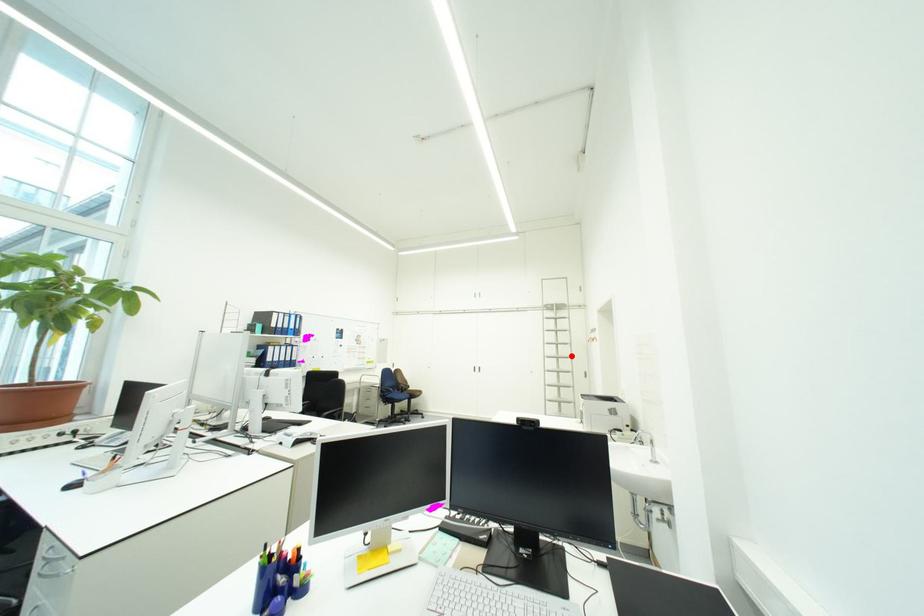
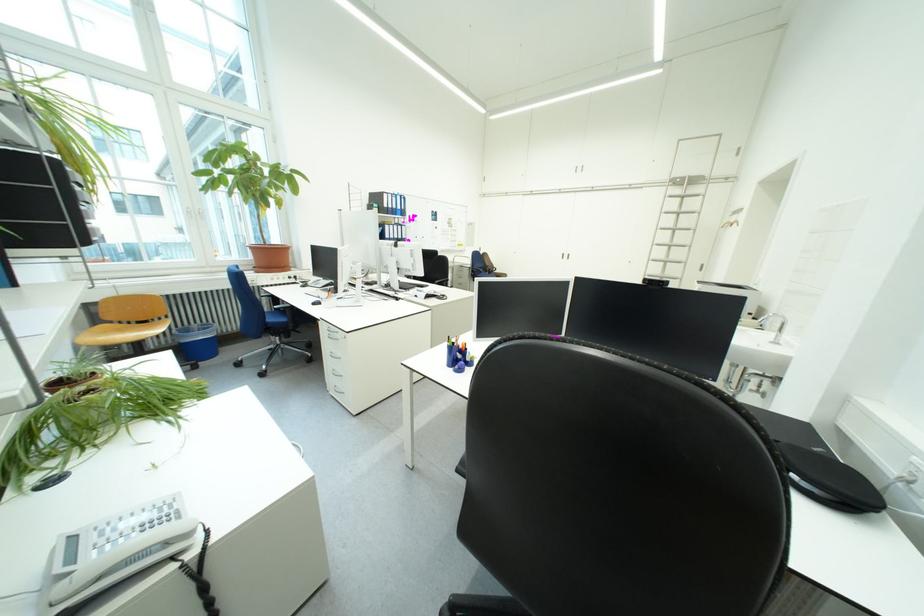
Question: I am providing you with two images of the same scene from different viewpoints. In image1, a red point is highlighted. Considering the same 3D point in image2, which of the following is correct?

Choices:
 (A) It is closer
 (B) It is farther

Answer: (A)